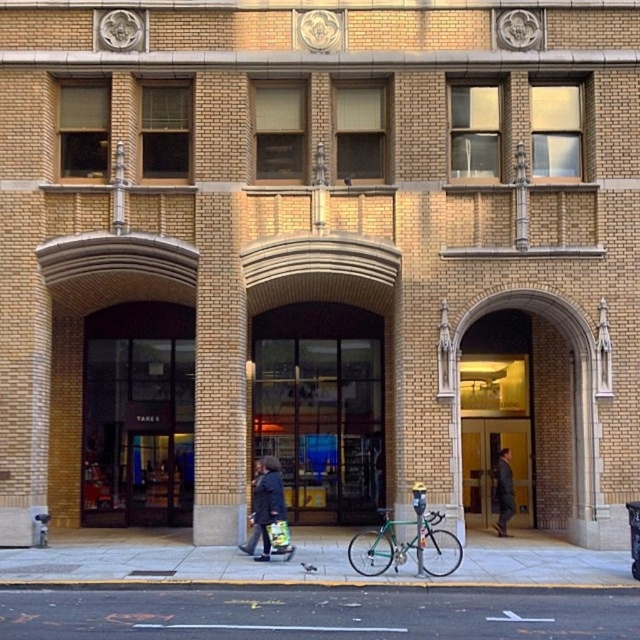
Question: Estimate the real-world distances between objects in this image. Which object is farther from the green metallic bicycle at center?

Choices:
 (A) smooth concrete sidewalk at center
 (B) gray asphalt at lower center
 (C) dark blue coat at center
 (D) dark gray coat at center

Answer: (D)

Question: Which point is closer to the camera?

Choices:
 (A) dark gray coat at center
 (B) smooth concrete sidewalk at center
 (C) gray asphalt at lower center
 (D) dark blue coat at center

Answer: (C)

Question: Which of the following is the closest to the observer?

Choices:
 (A) dark gray coat at center
 (B) green metallic bicycle at center
 (C) smooth concrete sidewalk at center

Answer: (C)

Question: Does smooth concrete sidewalk at center have a larger size compared to dark gray coat at center?

Choices:
 (A) yes
 (B) no

Answer: (A)

Question: Is smooth concrete sidewalk at center thinner than dark blue coat at center?

Choices:
 (A) no
 (B) yes

Answer: (A)

Question: Does smooth concrete sidewalk at center have a greater width compared to green metallic bicycle at center?

Choices:
 (A) yes
 (B) no

Answer: (A)